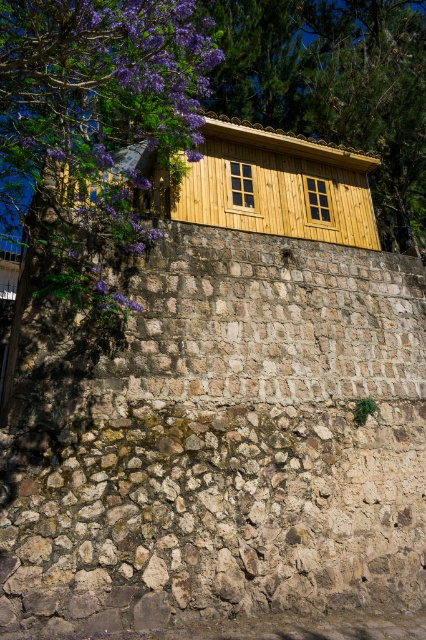
You are an architect designing a new garden layout. You need to place a decorative stone wall and a wooden window in the upper center area of the garden. Based on the image, which object has a smaller width between the brown stone wall at upper center and the wooden window at upper center?

The brown stone wall at upper center has a lesser width compared to the wooden window at upper center, so the brown stone wall at upper center is narrower.

You are a painter standing at the base of the rustic stone wall. You want to paint both the wooden window at upper center and the wooden window at center. If your ladder can reach up to 1.5 meters, can you paint both windows without moving the ladder?

The wooden window at upper center and wooden window at center are 1.28 meters apart. Since the ladder can reach up to 1.5 meters, you can paint both windows without moving the ladder as the distance between them is within the ladder reach.

You are an architect designing a new building and want to incorporate elements from this rustic stone wall scene. You have two wooden windows to place on your building design. The wooden window at upper center and the wooden window at center from the scene. Which window should you choose if you want a taller window for better light intake?

You should choose the wooden window at upper center because it is much taller than the wooden window at center, allowing for better light intake.